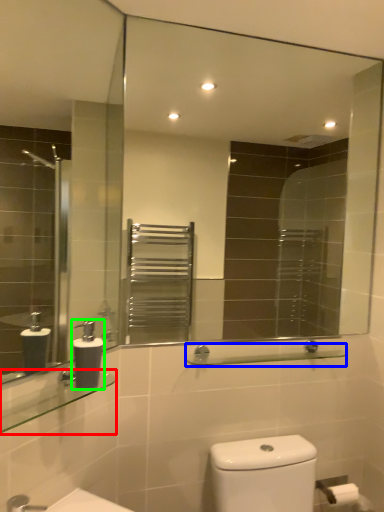
Question: Based on their relative distances, which object is nearer to balustrade (highlighted by a red box)? Choose from balustrade (highlighted by a blue box) and soap dispenser (highlighted by a green box).

Choices:
 (A) balustrade
 (B) soap dispenser

Answer: (B)